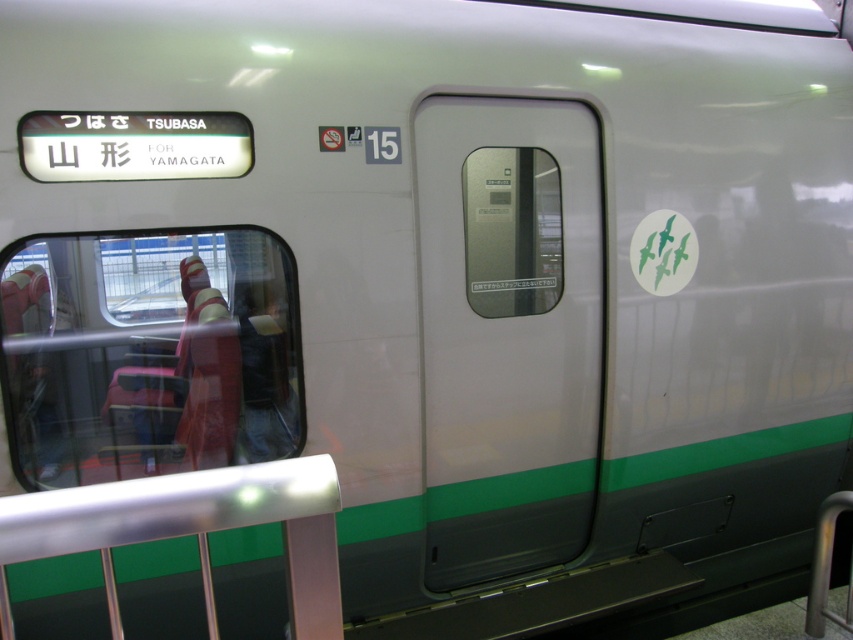
Which of these two, matte white door at center or metallic silver rail at lower left, stands shorter?

metallic silver rail at lower left is shorter.

The image size is (853, 640). In order to click on matte white door at center in this screenshot , I will do `click(508, 332)`.

Locate an element on the screen. The height and width of the screenshot is (640, 853). matte white door at center is located at coordinates (508, 332).

Does matte white door at center have a lesser height compared to denim pants at left?

In fact, matte white door at center may be taller than denim pants at left.

Measure the distance between matte white door at center and camera.

2.68 meters

Is point (430, 161) behind point (238, 301)?

That is True.

This screenshot has width=853, height=640. Find the location of `matte white door at center`. matte white door at center is located at coordinates (508, 332).

Is metallic silver rail at lower left to the right of denim pants at left from the viewer's perspective?

Indeed, metallic silver rail at lower left is positioned on the right side of denim pants at left.

Who is positioned more to the left, metallic silver rail at lower left or denim pants at left?

denim pants at left is more to the left.

The height and width of the screenshot is (640, 853). What do you see at coordinates (190, 529) in the screenshot? I see `metallic silver rail at lower left` at bounding box center [190, 529].

Image resolution: width=853 pixels, height=640 pixels. Find the location of `metallic silver rail at lower left`. metallic silver rail at lower left is located at coordinates (190, 529).